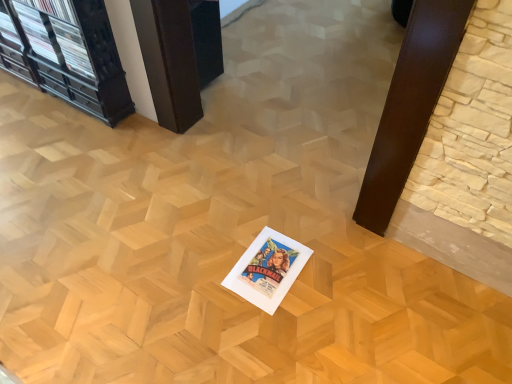
Locate an element on the screen. The image size is (512, 384). vacant space situated on the left part of white paper at center is located at coordinates (207, 270).